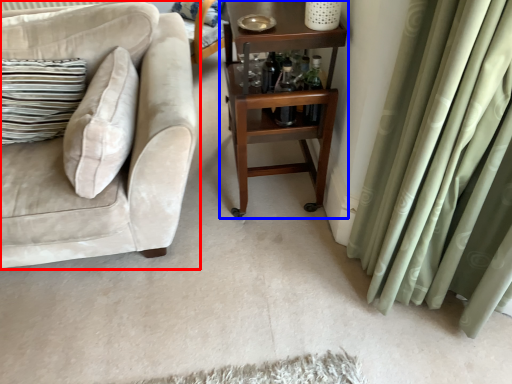
Question: Which point is further to the camera, studio couch (highlighted by a red box) or table (highlighted by a blue box)?

Choices:
 (A) studio couch
 (B) table

Answer: (B)